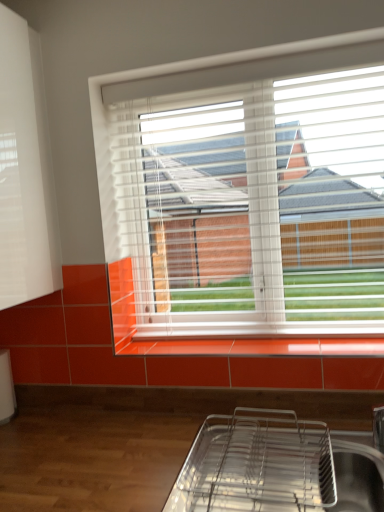
Question: Is metallic silver tray at lower center to the left or to the right of orange glossy tile at lower center in the image?

Choices:
 (A) left
 (B) right

Answer: (A)

Question: From the image's perspective, is metallic silver tray at lower center above or below orange glossy tile at lower center?

Choices:
 (A) above
 (B) below

Answer: (B)

Question: Which object is the closest to the white matte shutter at upper left?

Choices:
 (A) orange glossy tile at lower center
 (B) white plastic blinds at upper center
 (C) metallic silver tray at lower center

Answer: (B)

Question: Estimate the real-world distances between objects in this image. Which object is closer to the orange glossy tile at lower center?

Choices:
 (A) metallic silver tray at lower center
 (B) white matte shutter at upper left
 (C) white plastic blinds at upper center

Answer: (A)